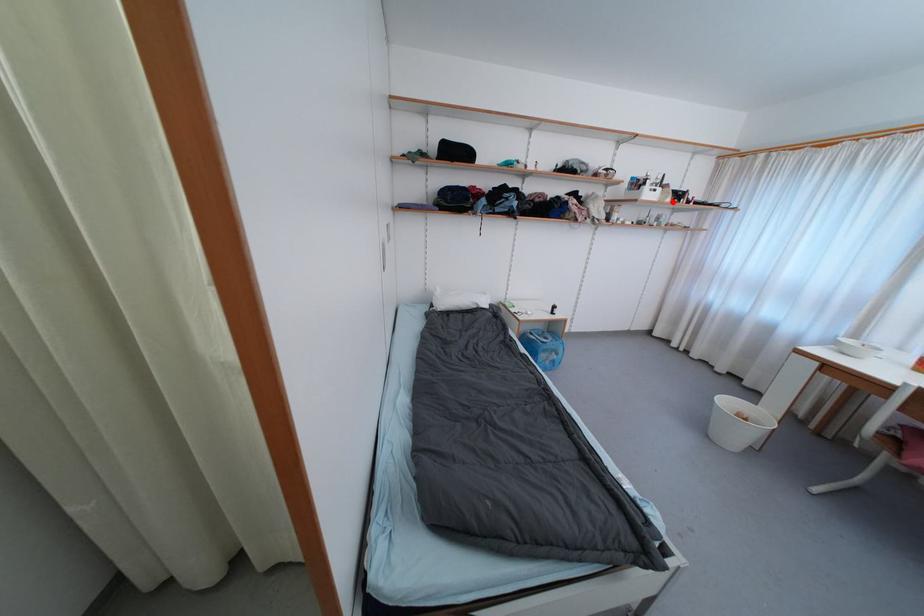
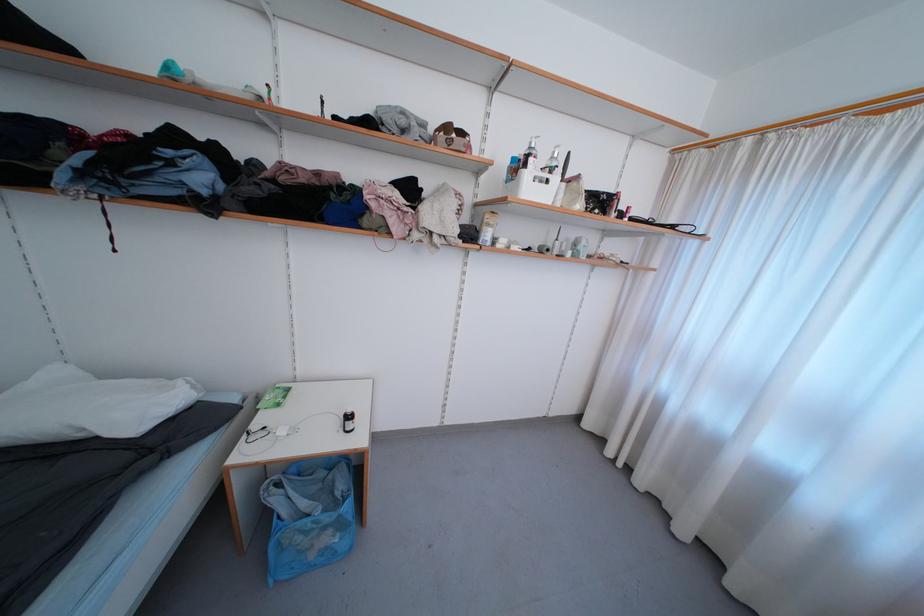
In the second image, find the point that corresponds to the highlighted location in the first image.

(584, 208)